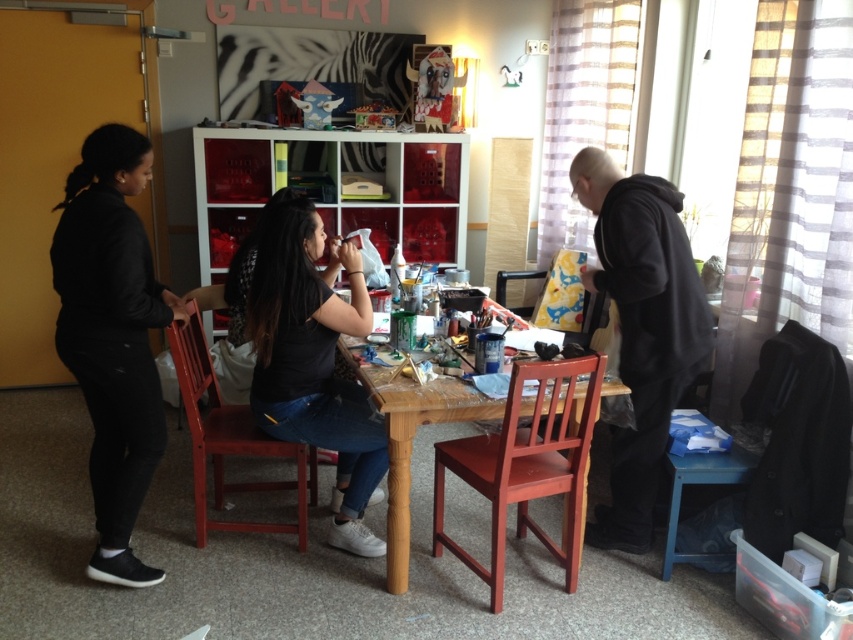
Is black matte pants at left to the left of black matte shirt at center from the viewer's perspective?

Yes, black matte pants at left is to the left of black matte shirt at center.

Which is in front, point (57, 323) or point (345, 252)?

Positioned in front is point (57, 323).

Describe the element at coordinates (112, 337) in the screenshot. The image size is (853, 640). I see `black matte pants at left` at that location.

Where is `black matte pants at left`? black matte pants at left is located at coordinates (112, 337).

Between black hoodie at right and wooden table at center, which one has less height?

Standing shorter between the two is wooden table at center.

Does black hoodie at right have a greater height compared to wooden table at center?

Yes, black hoodie at right is taller than wooden table at center.

Is point (605, 266) in front of point (424, 404)?

No, it is behind (424, 404).

Identify the location of black hoodie at right. (641, 330).

Can you confirm if black matte shirt at center is positioned to the left of satin wood chair at center?

Correct, you'll find black matte shirt at center to the left of satin wood chair at center.

Does black matte shirt at center lie behind satin wood chair at center?

Yes.

Find the location of a particular element. black matte shirt at center is located at coordinates (314, 362).